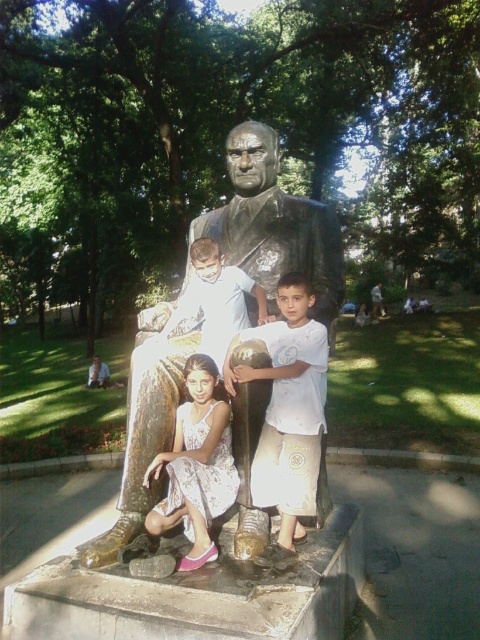
You are a photographer trying to capture a group photo of the bronze statue at center and the light brown skin at statue center. Based on their positions, can you tell which one is closer to the camera?

The bronze statue at center is in front of light brown skin at statue center, so the bronze statue at center is closer to the camera.

You are a photographer trying to capture the bronze statue at center and the white cotton shirt at center in a single photo. However, the statue is blocking part of the shirt. Can you adjust your position so that both are fully visible without any obstruction?

The white cotton shirt at center is behind the bronze statue at center, so moving the camera position to the side of the statue would allow both the bronze statue at center and the white cotton shirt at center to be visible without obstruction.

You are a photographer trying to capture a group photo of the children near the statue. You notice the white cotton shirt at center and the light brown skin at statue center in your frame. Which object in your viewfinder takes up more space?

The white cotton shirt at center takes up more space than the light brown skin at statue center because it is bigger.